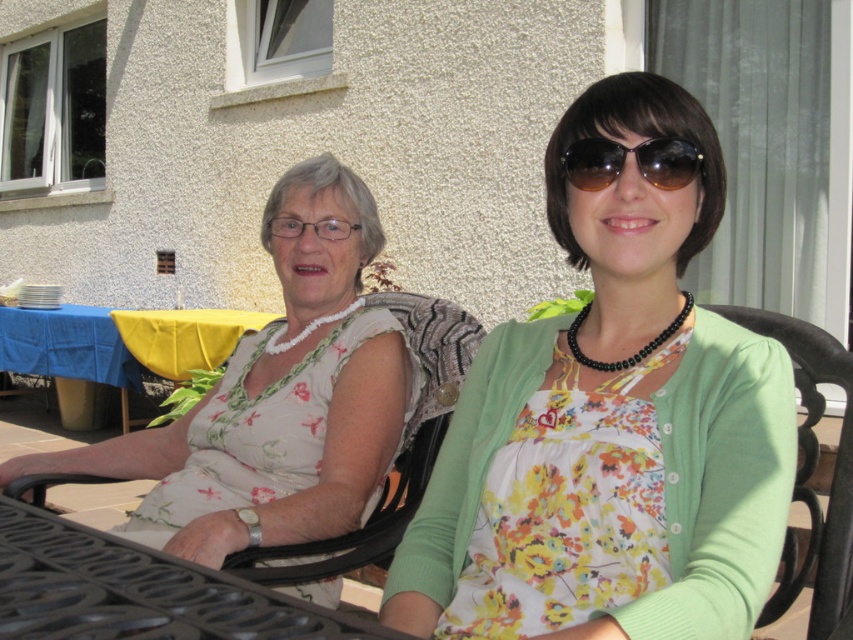
Can you confirm if blue cloth-covered table at lower left is shorter than yellow fabric table at lower left?

Yes.

Describe the element at coordinates (67, 346) in the screenshot. The height and width of the screenshot is (640, 853). I see `blue cloth-covered table at lower left` at that location.

The width and height of the screenshot is (853, 640). In order to click on blue cloth-covered table at lower left in this screenshot , I will do `click(67, 346)`.

Who is taller, black metal table at lower left or blue cloth-covered table at lower left?

blue cloth-covered table at lower left

Is point (294, 628) farther from camera compared to point (45, 320)?

No.

What are the coordinates of `black metal table at lower left` in the screenshot? It's located at (138, 592).

Is point (358, 461) in front of point (57, 580)?

No.

Locate an element on the screen. This screenshot has height=640, width=853. floral fabric dress at left is located at coordinates (277, 397).

Identify the location of floral fabric dress at left. (277, 397).